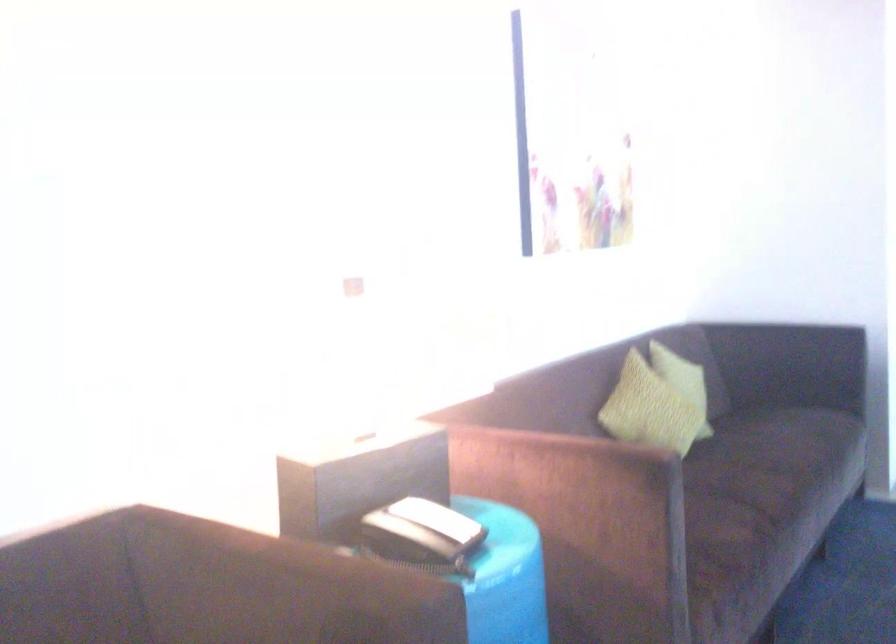
Where is `dark square box`? The width and height of the screenshot is (896, 644). dark square box is located at coordinates (357, 474).